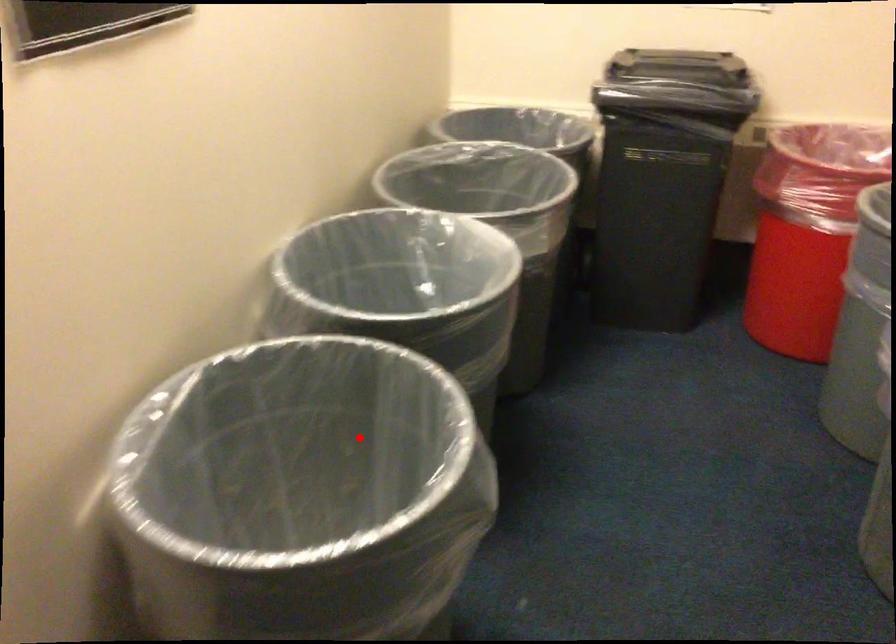
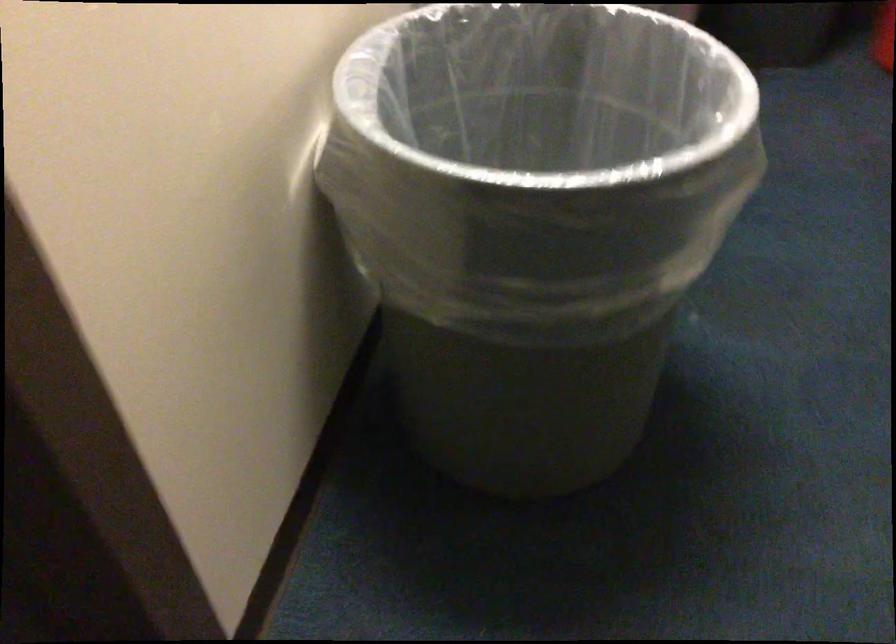
The point at the highlighted location is marked in the first image. Where is the corresponding point in the second image?

(538, 136)